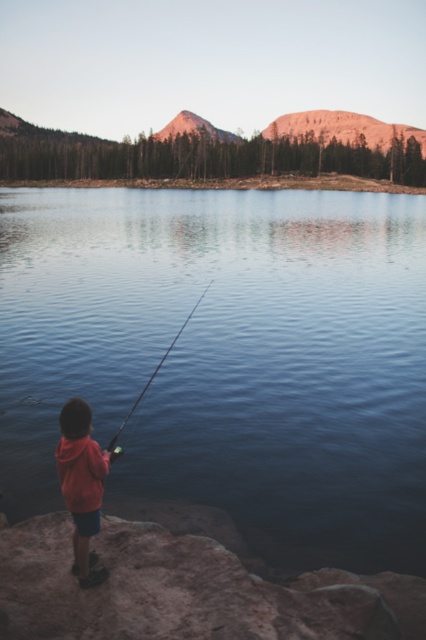
Based on the photo, you are standing at the point marked by coordinates point (414, 500) and want to throw a stone into the lake. The stone you have can travel up to 7 meters. Will it reach the lake?

The distance between point (414, 500) and the viewer is 6.90 meters, so yes, the stone can reach the lake as it is within the 7 meter range.

You are standing on the smooth sand shore at center and want to reach the smooth black rod at center. Which direction should you move to get there?

You should move to the right because the smooth sand shore at center is to the left of the smooth black rod at center.

You are a hiker who needs to cross from the smooth black rod at center to the smooth sand shore at center. Given that your backpack weighs 10 kilograms, can you safely make this journey? Please explain your reasoning based on the distance between the two points.

The smooth sand shore at center is 162.46 meters away from the smooth black rod at center. Since the distance is over 100 meters, and carrying a 10 kg backpack, it would be physically demanding but possible to walk the distance. However, the path between them isn not described, so caution is advised.